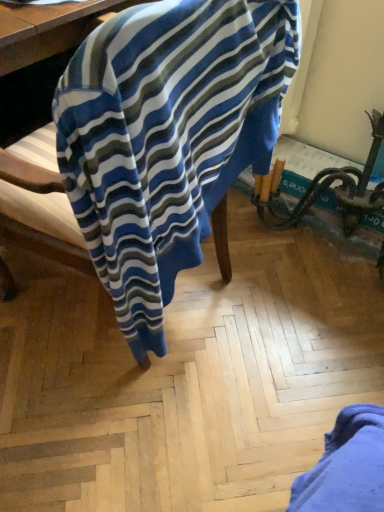
What do you see at coordinates (167, 137) in the screenshot?
I see `blue striped fabric at center` at bounding box center [167, 137].

Where is `blue striped fabric at center`? This screenshot has height=512, width=384. blue striped fabric at center is located at coordinates (167, 137).

The height and width of the screenshot is (512, 384). In order to click on blue striped fabric at center in this screenshot , I will do `click(167, 137)`.